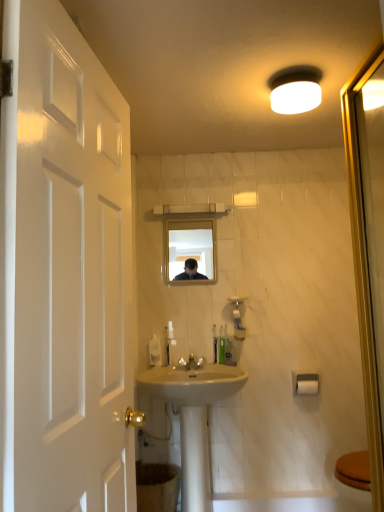
Question: Considering the relative sizes of white matte toilet paper at lower right and clear glass mirror at center in the image provided, is white matte toilet paper at lower right thinner than clear glass mirror at center?

Choices:
 (A) yes
 (B) no

Answer: (B)

Question: Is white matte toilet paper at lower right next to clear glass mirror at center?

Choices:
 (A) yes
 (B) no

Answer: (B)

Question: Can you confirm if white matte toilet paper at lower right is positioned to the right of clear glass mirror at center?

Choices:
 (A) no
 (B) yes

Answer: (B)

Question: Is clear glass mirror at center at the back of white matte toilet paper at lower right?

Choices:
 (A) no
 (B) yes

Answer: (A)

Question: Can you confirm if white matte toilet paper at lower right is positioned to the left of clear glass mirror at center?

Choices:
 (A) no
 (B) yes

Answer: (A)

Question: Does white matte toilet paper at lower right come in front of clear glass mirror at center?

Choices:
 (A) no
 (B) yes

Answer: (B)

Question: From a real-world perspective, does white ceramic sink at center sit lower than translucent plastic soap dispenser at center, the first toiletry viewed from the left?

Choices:
 (A) no
 (B) yes

Answer: (B)

Question: Is translucent plastic soap dispenser at center, the first toiletry viewed from the left, located within white ceramic sink at center?

Choices:
 (A) no
 (B) yes

Answer: (A)

Question: Is white ceramic sink at center outside translucent plastic soap dispenser at center, the first toiletry viewed from the left?

Choices:
 (A) yes
 (B) no

Answer: (A)

Question: Does white ceramic sink at center come in front of translucent plastic soap dispenser at center, placed as the second toiletry when sorted from right to left?

Choices:
 (A) no
 (B) yes

Answer: (B)

Question: Does white ceramic sink at center have a greater width compared to translucent plastic soap dispenser at center, the first toiletry viewed from the left?

Choices:
 (A) yes
 (B) no

Answer: (A)

Question: Considering the relative sizes of white ceramic sink at center and translucent plastic soap dispenser at center, the first toiletry viewed from the left, in the image provided, is white ceramic sink at center shorter than translucent plastic soap dispenser at center, the first toiletry viewed from the left,?

Choices:
 (A) no
 (B) yes

Answer: (A)

Question: Is clear glass mirror at center looking in the opposite direction of white glossy faucet at center?

Choices:
 (A) no
 (B) yes

Answer: (A)